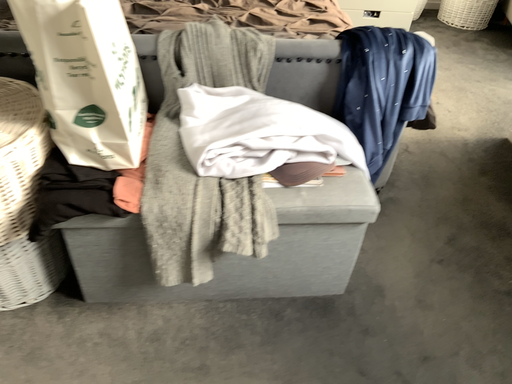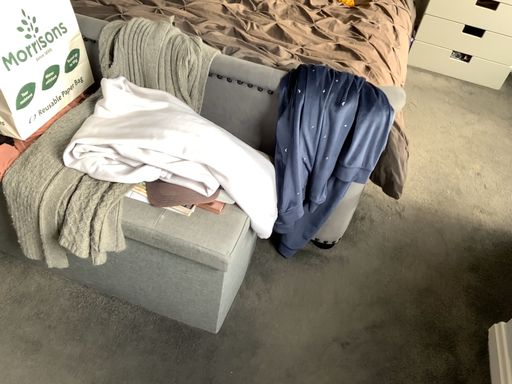
Question: How did the camera likely rotate when shooting the video?

Choices:
 (A) rotated right
 (B) rotated left

Answer: (B)